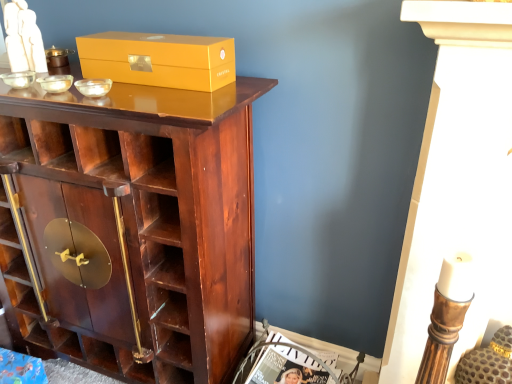
Question: Is matte white magazine at lower center bigger or smaller than matte gold box at upper center?

Choices:
 (A) small
 (B) big

Answer: (B)

Question: Considering their positions, is matte white magazine at lower center located in front of or behind matte gold box at upper center?

Choices:
 (A) behind
 (B) front

Answer: (A)

Question: Estimate the real-world distances between objects in this image. Which object is farther from the matte white magazine at lower center?

Choices:
 (A) matte gold box at upper center
 (B) shiny dark wood cupboard at center

Answer: (A)

Question: Which is nearer to the matte white magazine at lower center?

Choices:
 (A) matte gold box at upper center
 (B) shiny dark wood cupboard at center

Answer: (B)